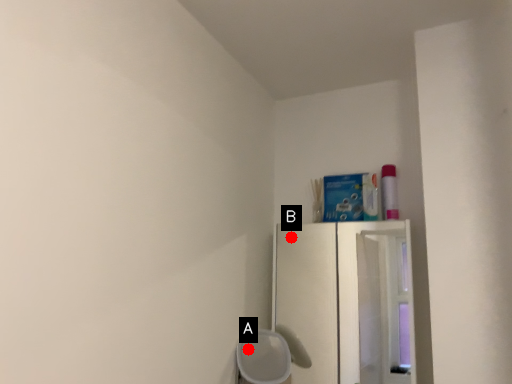
Question: Two points are circled on the image, labeled by A and B beside each circle. Which of the following is the closest to the observer?

Choices:
 (A) A is closer
 (B) B is closer

Answer: (B)